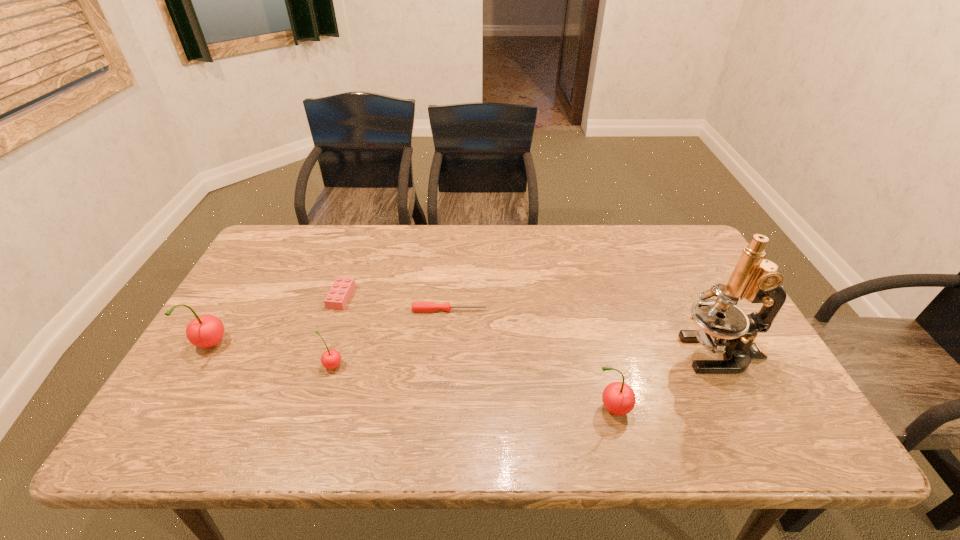
You are a GUI agent. You are given a task and a screenshot of the screen. Output one action in this format:
    pyautogui.click(x=<x>, y=<y>)
    Task: Click on the object present at the right edge
    The width and height of the screenshot is (960, 540).
    Given the screenshot: What is the action you would take?
    pos(724,328)

Find the location of a particular element. Image resolution: width=960 pixels, height=540 pixels. free point at the far edge is located at coordinates (430, 266).

In the image, there is a desktop. Find the location of `free space at the near edge`. free space at the near edge is located at coordinates (718, 404).

Identify the location of vacant space at the left edge of the desktop. The width and height of the screenshot is (960, 540). coord(289,298).

In the image, there is a desktop. Where is `free region at the far left corner`? free region at the far left corner is located at coordinates (302, 245).

Find the location of a particular element. vacant area at the near left corner of the desktop is located at coordinates (214, 389).

Find the location of a particular element. This screenshot has width=960, height=540. vacant space at the far right corner of the desktop is located at coordinates (685, 239).

Where is `free spot between the rightmost object and the second object from right to left`? Image resolution: width=960 pixels, height=540 pixels. free spot between the rightmost object and the second object from right to left is located at coordinates (665, 381).

Where is `vacant point located between the Lego and the leftmost cherry`? vacant point located between the Lego and the leftmost cherry is located at coordinates (276, 322).

This screenshot has height=540, width=960. What are the coordinates of `blank region between the shortest object and the rightmost object` in the screenshot? It's located at (585, 332).